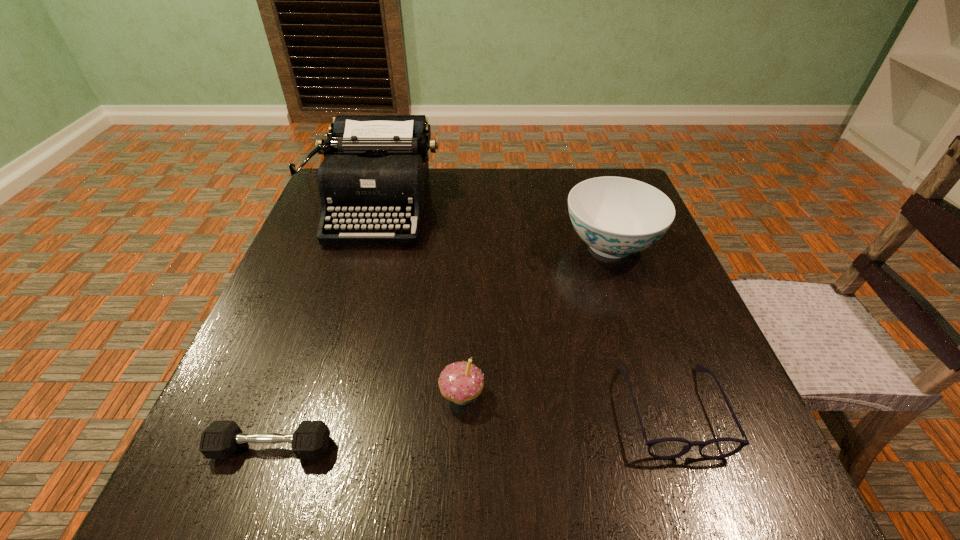
I want to click on typewriter, so click(x=375, y=170).

This screenshot has height=540, width=960. I want to click on chinaware, so click(x=616, y=216).

Find the location of a particular element. The image size is (960, 540). the third object from right to left is located at coordinates pos(460,382).

Locate an element on the screen. The height and width of the screenshot is (540, 960). spectacles is located at coordinates (664, 448).

At what (x,y) coordinates should I click in order to perform the action: click on dumbbell. Please return your answer as a coordinate pair (x, y). Looking at the image, I should click on (220, 439).

Locate an element on the screen. The image size is (960, 540). vacant region located on the typing side of the typewriter is located at coordinates (346, 310).

You are a GUI agent. You are given a task and a screenshot of the screen. Output one action in this format:
    pyautogui.click(x=<x>, y=<y>)
    Task: Click on the free space located on the back of the chinaware
    Image resolution: width=960 pixels, height=540 pixels.
    Given the screenshot: What is the action you would take?
    pyautogui.click(x=585, y=170)

Where is `free space located on the back of the third object from right to left`? This screenshot has width=960, height=540. free space located on the back of the third object from right to left is located at coordinates (468, 239).

At what (x,y) coordinates should I click in order to perform the action: click on free space located 0.160m on the back of the dumbbell. Please return your answer as a coordinate pair (x, y). Looking at the image, I should click on [x=306, y=349].

Identify the location of typewriter that is at the far edge. 375,170.